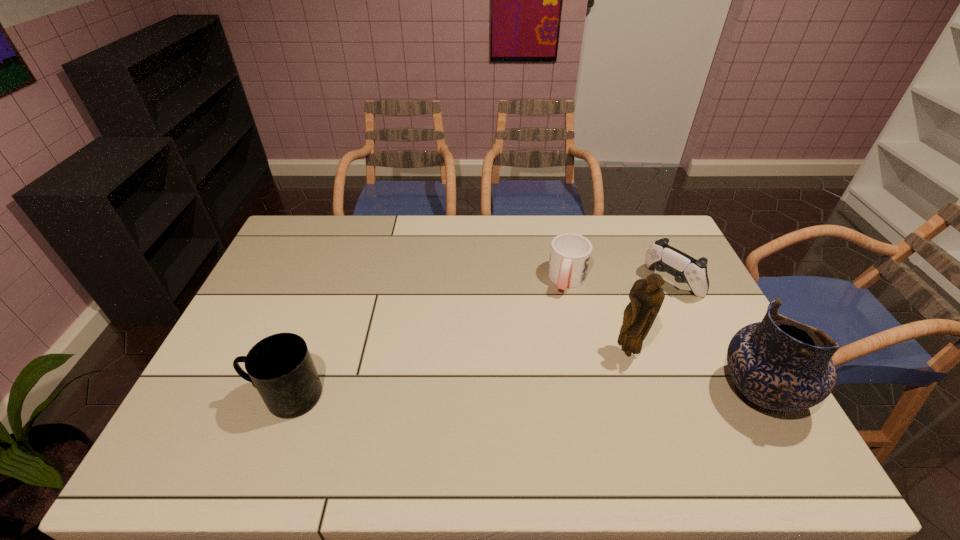
The image size is (960, 540). What are the coordinates of `vacant point located 0.100m on the back of the pottery` in the screenshot? It's located at (724, 332).

The width and height of the screenshot is (960, 540). I want to click on free space located on the front-facing side of the figurine, so click(571, 406).

The width and height of the screenshot is (960, 540). I want to click on free point located 0.190m on the front-facing side of the figurine, so click(x=576, y=401).

The image size is (960, 540). Identify the location of free space located on the front-facing side of the figurine. (574, 403).

The height and width of the screenshot is (540, 960). In order to click on free spot located 0.360m on the front-facing side of the control in this screenshot , I will do `click(584, 356)`.

Where is `vacant space situated on the front-facing side of the control`? The image size is (960, 540). vacant space situated on the front-facing side of the control is located at coordinates (610, 334).

I want to click on blank space located 0.300m on the front-facing side of the control, so click(597, 345).

Find the location of `vacant region located on the side of the shorter mug with the handle`. vacant region located on the side of the shorter mug with the handle is located at coordinates (562, 308).

Find the location of a particular element. Image resolution: width=960 pixels, height=540 pixels. vacant space located on the side of the shorter mug with the handle is located at coordinates (548, 355).

This screenshot has width=960, height=540. I want to click on free region located 0.130m on the side of the shorter mug with the handle, so click(556, 327).